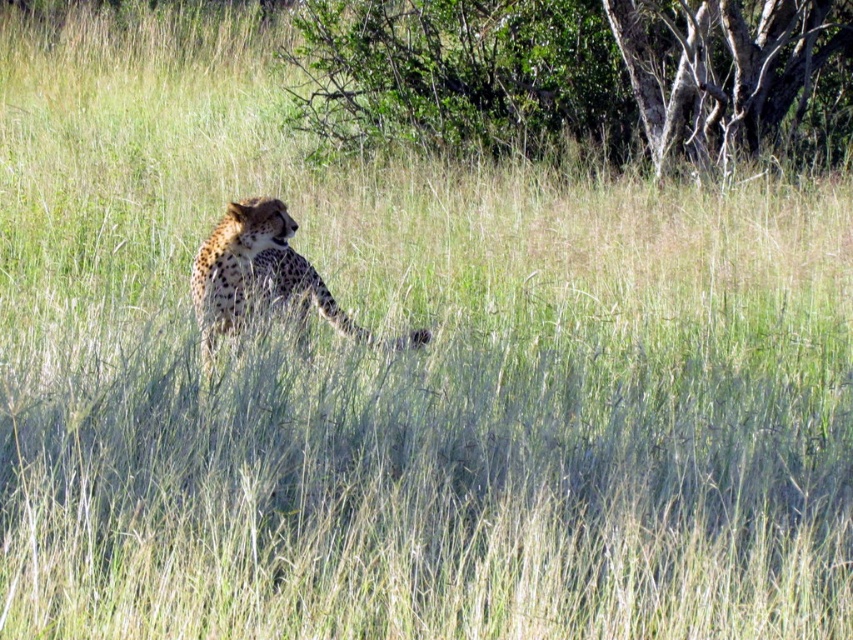
Who is lower down, green leafy tree at upper center or spotted fur cheetah at center?

spotted fur cheetah at center

Does green leafy tree at upper center have a lesser height compared to spotted fur cheetah at center?

Incorrect, green leafy tree at upper center's height does not fall short of spotted fur cheetah at center's.

Image resolution: width=853 pixels, height=640 pixels. What are the coordinates of `green leafy tree at upper center` in the screenshot? It's located at point(572,76).

Image resolution: width=853 pixels, height=640 pixels. Find the location of `green leafy tree at upper center`. green leafy tree at upper center is located at coordinates (572, 76).

Looking at this image, is smooth bark tree at upper right to the left of spotted fur cheetah at center from the viewer's perspective?

In fact, smooth bark tree at upper right is to the right of spotted fur cheetah at center.

Between smooth bark tree at upper right and spotted fur cheetah at center, which one has less height?

Standing shorter between the two is spotted fur cheetah at center.

You are a GUI agent. You are given a task and a screenshot of the screen. Output one action in this format:
    pyautogui.click(x=<x>, y=<y>)
    Task: Click on the smooth bark tree at upper right
    This screenshot has height=640, width=853.
    Given the screenshot: What is the action you would take?
    pyautogui.click(x=720, y=68)

Based on the photo, which of these two, green leafy tree at upper center or smooth bark tree at upper right, stands taller?

smooth bark tree at upper right is taller.

Who is positioned more to the right, green leafy tree at upper center or smooth bark tree at upper right?

smooth bark tree at upper right

Does point (345, 29) come farther from viewer compared to point (663, 16)?

Yes, it is behind point (663, 16).

Where is `green leafy tree at upper center`? green leafy tree at upper center is located at coordinates (572, 76).